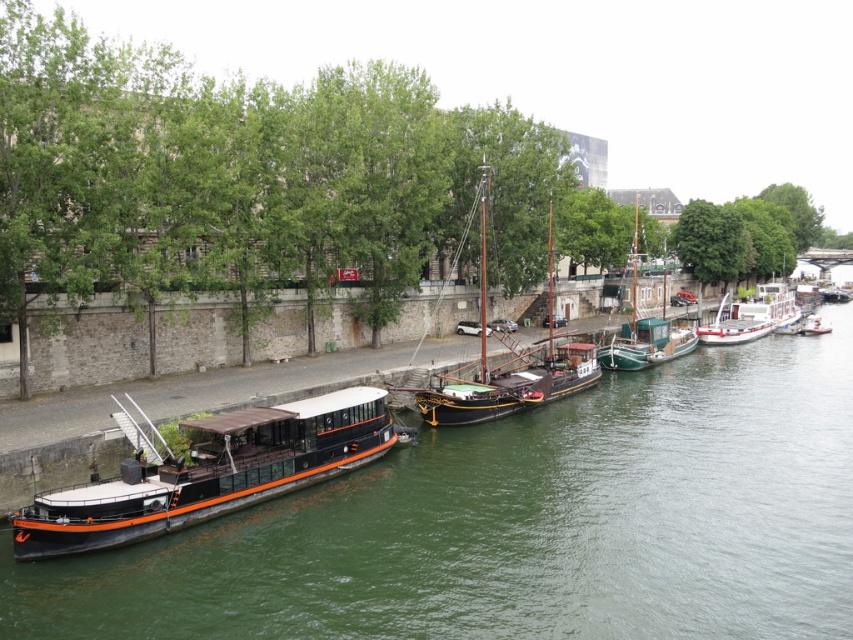
Image resolution: width=853 pixels, height=640 pixels. What do you see at coordinates (526, 524) in the screenshot?
I see `green water at lower left` at bounding box center [526, 524].

Is point (447, 454) less distant than point (715, 339)?

Yes.

Which is behind, point (3, 605) or point (785, 323)?

The point (785, 323) is behind.

The image size is (853, 640). I want to click on green water at lower left, so click(x=526, y=524).

Between orange glossy barge at center and white glossy barge at right, which one is positioned higher?

white glossy barge at right

Who is positioned more to the left, orange glossy barge at center or white glossy barge at right?

orange glossy barge at center

Image resolution: width=853 pixels, height=640 pixels. Find the location of `orange glossy barge at center`. orange glossy barge at center is located at coordinates (207, 470).

Describe the element at coordinates (207, 470) in the screenshot. I see `orange glossy barge at center` at that location.

Locate an element on the screen. This screenshot has height=640, width=853. orange glossy barge at center is located at coordinates (207, 470).

Identify the location of orange glossy barge at center. The height and width of the screenshot is (640, 853). (207, 470).